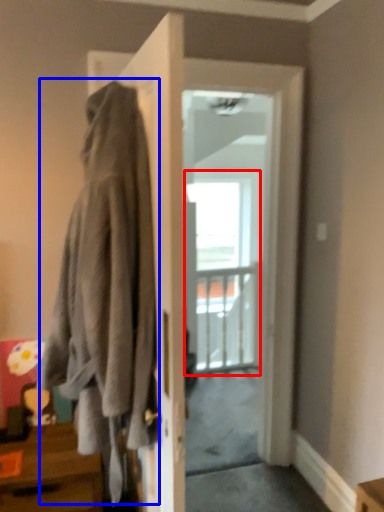
Question: Which object appears closest to the camera in this image, glass door (highlighted by a red box) or laundry (highlighted by a blue box)?

Choices:
 (A) glass door
 (B) laundry

Answer: (B)